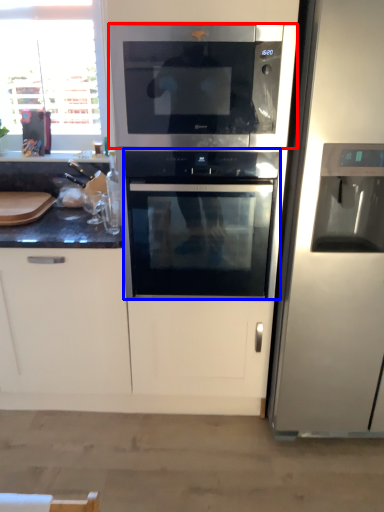
Question: Which of the following is the closest to the observer, microwave oven (highlighted by a red box) or oven (highlighted by a blue box)?

Choices:
 (A) microwave oven
 (B) oven

Answer: (A)